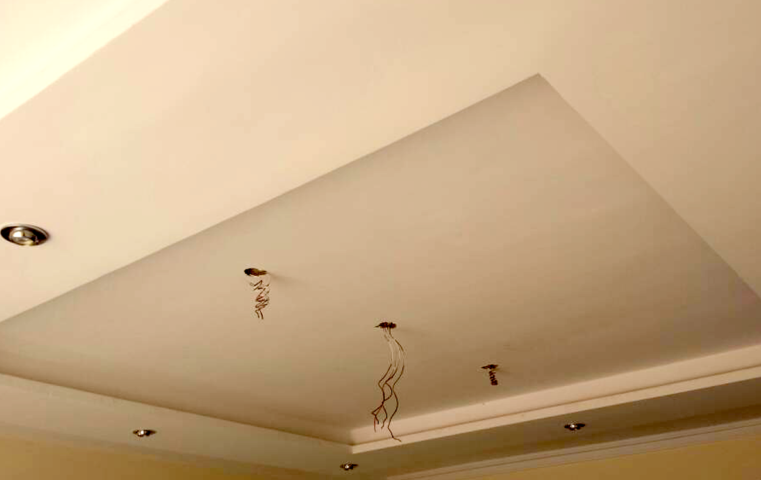
This screenshot has height=480, width=761. Find the location of `white ceiling`. white ceiling is located at coordinates (244, 93).